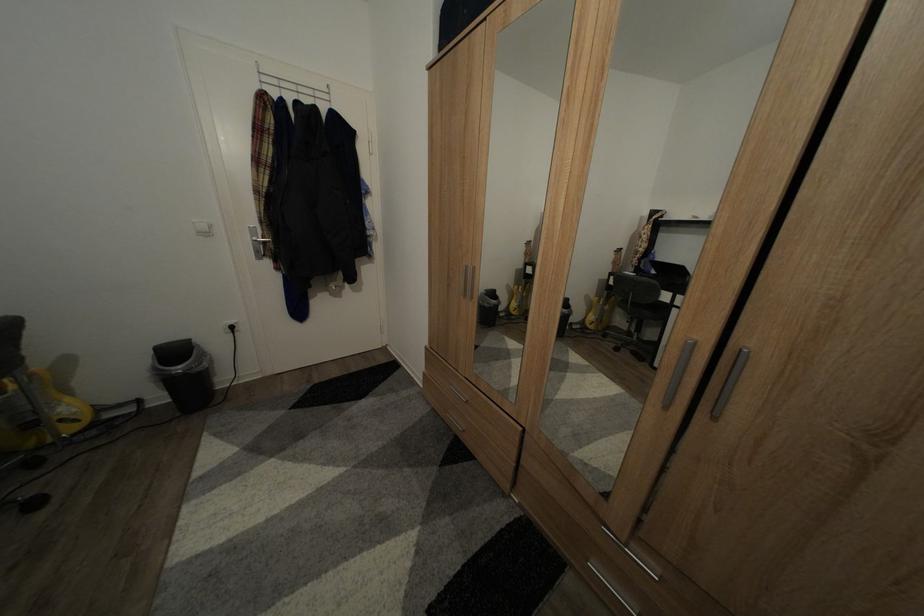
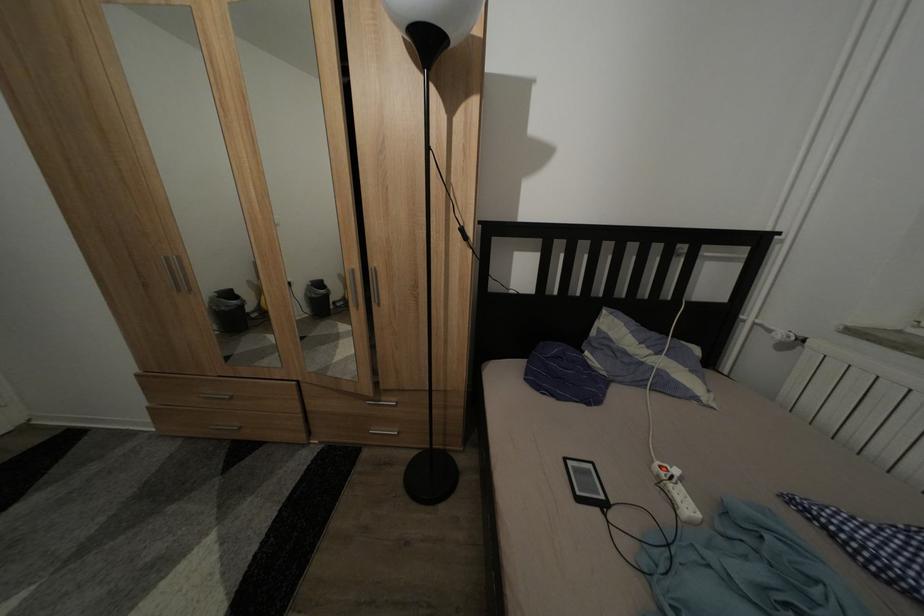
Where in the second image is the point corresponding to point (593, 302) from the first image?

(347, 282)